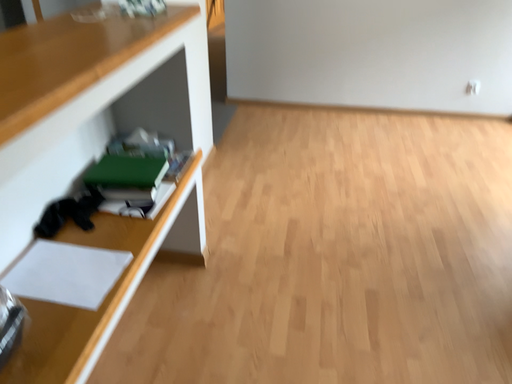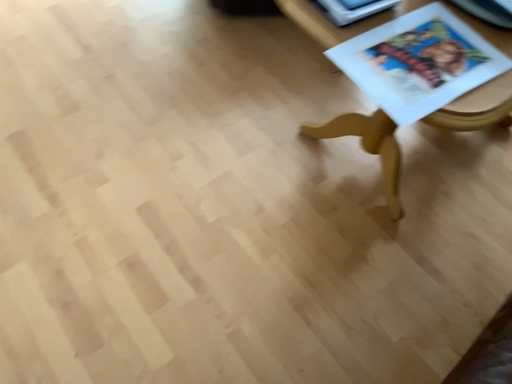
Question: Which way did the camera rotate in the video?

Choices:
 (A) rotated left
 (B) rotated right

Answer: (B)